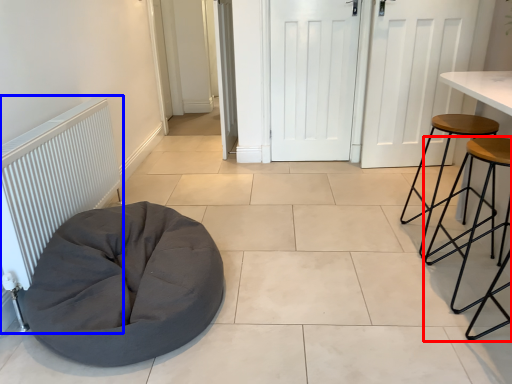
Question: Which of the following is the farthest to the observer, stool (highlighted by a red box) or radiator (highlighted by a blue box)?

Choices:
 (A) stool
 (B) radiator

Answer: (A)